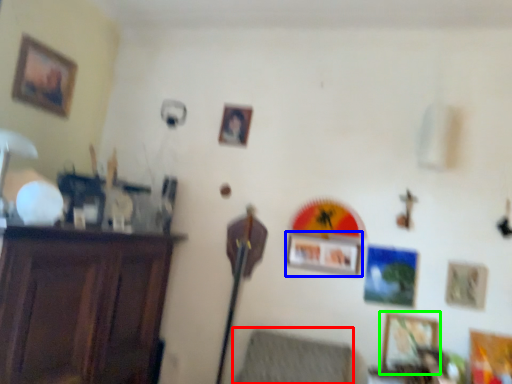
Question: Considering the real-world distances, which object is closest to swivel chair (highlighted by a red box)? picture frame (highlighted by a blue box) or picture frame (highlighted by a green box).

Choices:
 (A) picture frame
 (B) picture frame

Answer: (B)